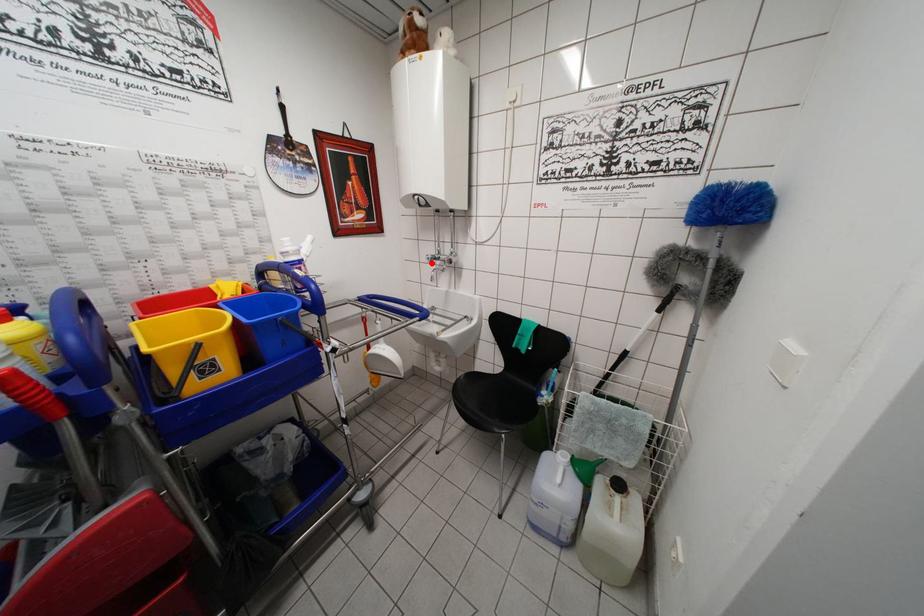
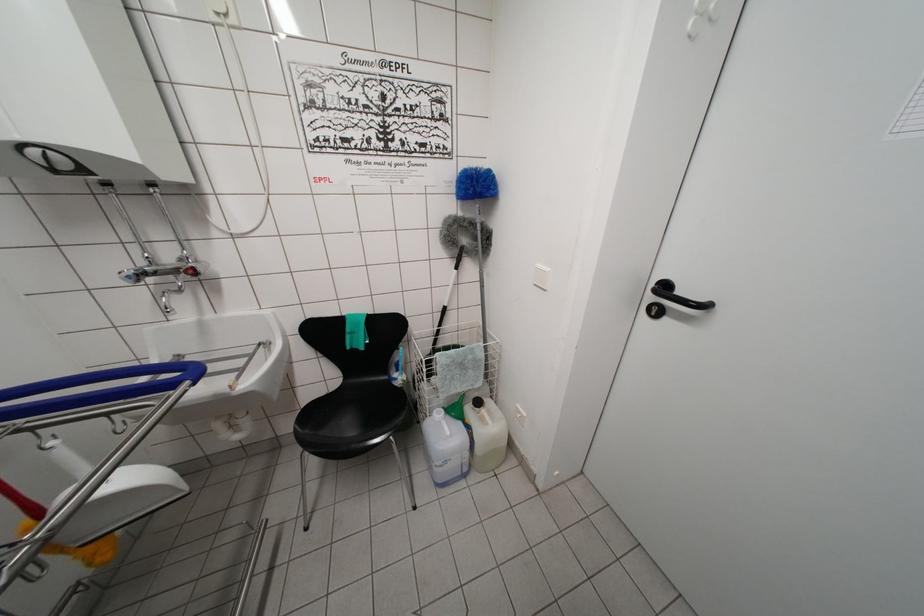
The point at the highlighted location is marked in the first image. Where is the corresponding point in the second image?

(131, 282)